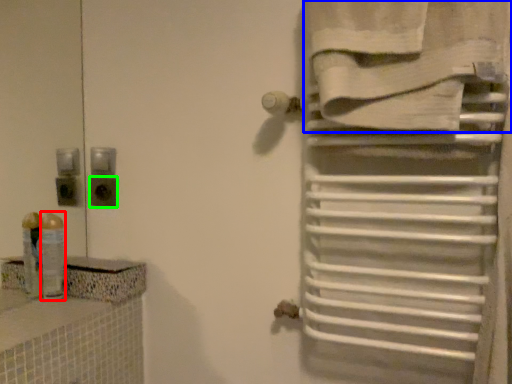
Question: Considering the real-world distances, which object is farthest from toiletry (highlighted by a red box)? towel (highlighted by a blue box) or electric outlet (highlighted by a green box)?

Choices:
 (A) towel
 (B) electric outlet

Answer: (A)